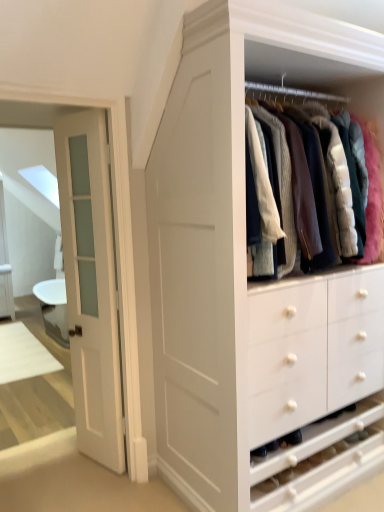
Identify the location of free space in front of white glossy door at left. This screenshot has width=384, height=512. (69, 487).